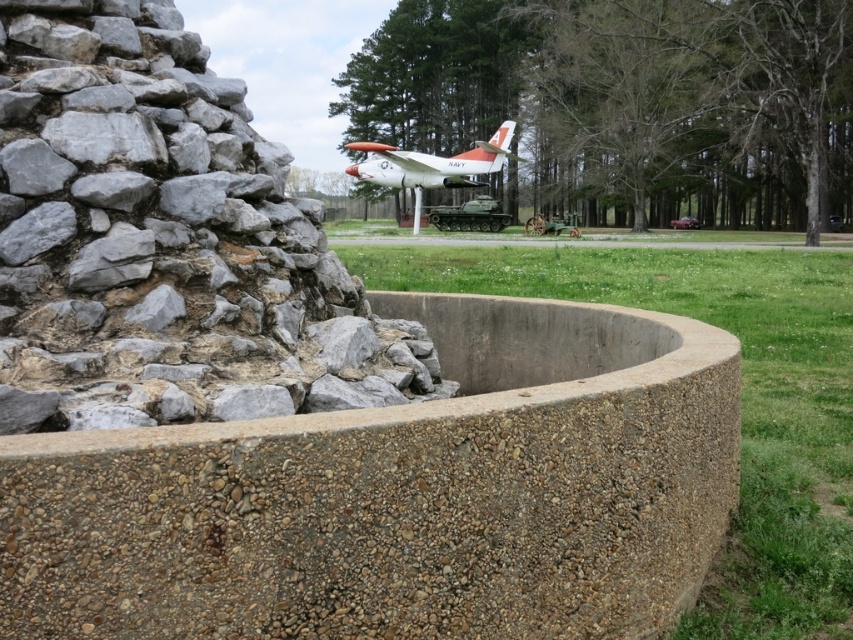
Question: Is gray rough stone at left smaller than orange matte airplane at center?

Choices:
 (A) yes
 (B) no

Answer: (A)

Question: Is gray concrete basin at center wider than orange matte airplane at center?

Choices:
 (A) yes
 (B) no

Answer: (B)

Question: Among these objects, which one is nearest to the camera?

Choices:
 (A) gray concrete basin at center
 (B) orange matte airplane at center
 (C) gray rough stone at left

Answer: (A)

Question: Is gray concrete basin at center wider than orange matte airplane at center?

Choices:
 (A) no
 (B) yes

Answer: (A)

Question: Which of the following is the closest to the observer?

Choices:
 (A) (213, 113)
 (B) (467, 157)
 (C) (48, 444)

Answer: (C)

Question: Which point is closer to the camera?

Choices:
 (A) (181, 470)
 (B) (439, 182)

Answer: (A)